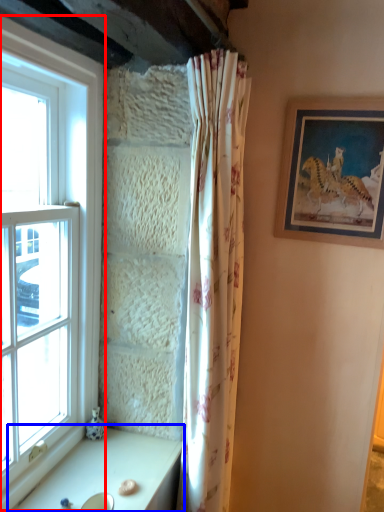
Question: Which object is closer to the camera taking this photo, window (highlighted by a red box) or table (highlighted by a blue box)?

Choices:
 (A) window
 (B) table

Answer: (A)